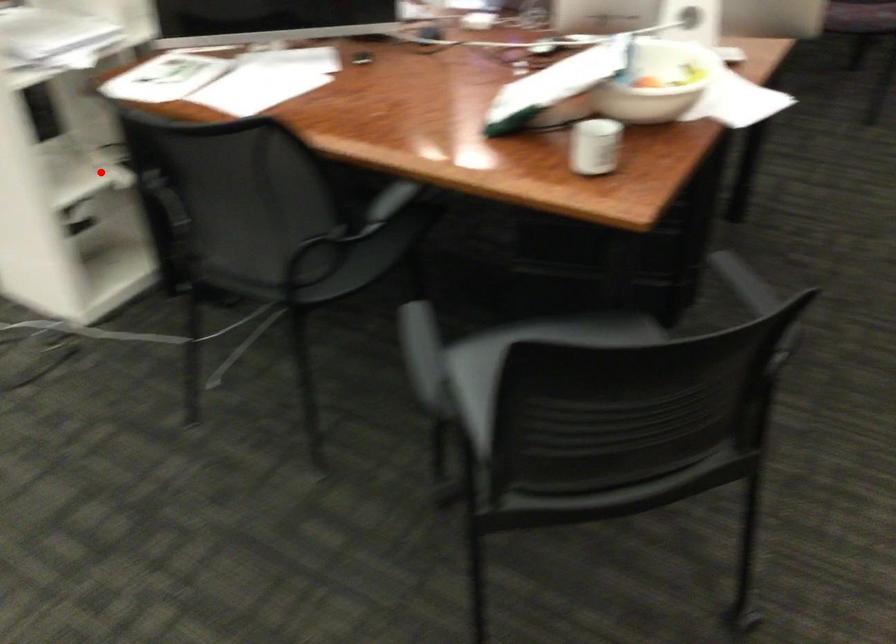
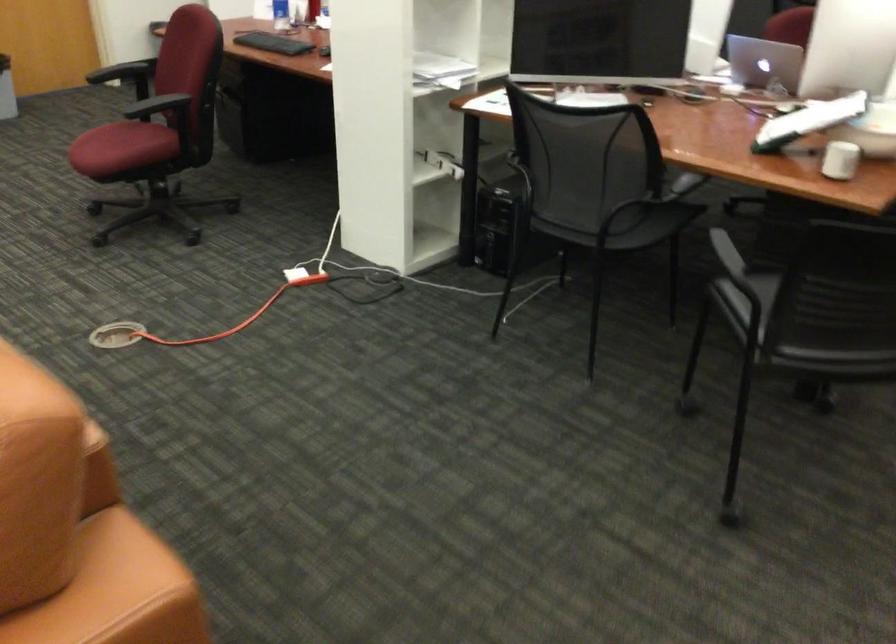
Question: A red point is marked in image1. In image2, is the corresponding 3D point closer to the camera or farther? Reply with the corresponding letter.

Choices:
 (A) The corresponding 3D point is closer.
 (B) The corresponding 3D point is farther.

Answer: (B)